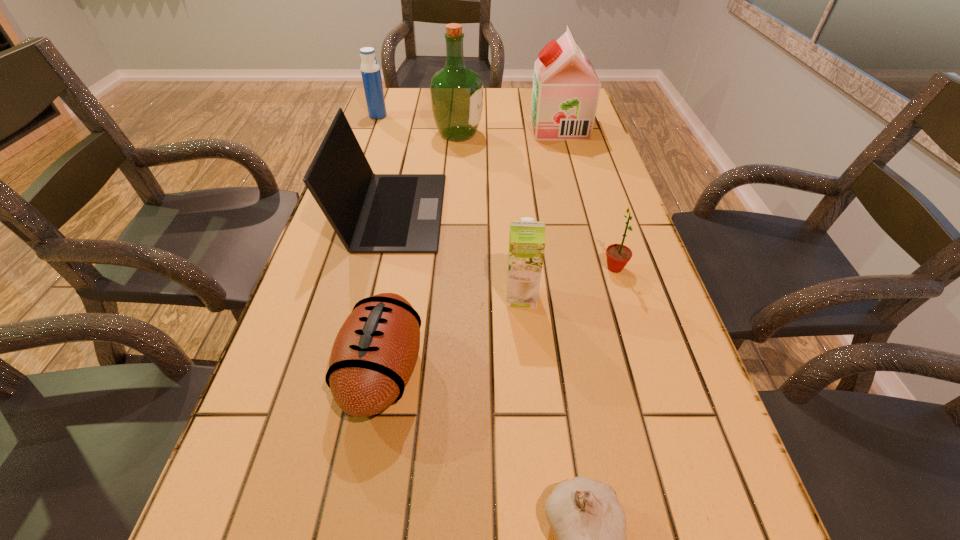
At what (x,y) coordinates should I click in order to perform the action: click on vacant space located on the front-facing side of the liquor. Please return your answer as a coordinate pair (x, y). This screenshot has width=960, height=540. Looking at the image, I should click on (528, 134).

This screenshot has width=960, height=540. Find the location of `free spot located with the cap open on the farther soya milk`. free spot located with the cap open on the farther soya milk is located at coordinates (420, 127).

What are the coordinates of `free space located with the cap open on the farther soya milk` in the screenshot? It's located at (468, 127).

Image resolution: width=960 pixels, height=540 pixels. Find the location of `free region located 0.370m with the cap open on the farther soya milk`. free region located 0.370m with the cap open on the farther soya milk is located at coordinates (423, 127).

This screenshot has width=960, height=540. I want to click on free location located on the back of the water bottle, so click(x=386, y=94).

Locate an element on the screen. The width and height of the screenshot is (960, 540). free space located 0.090m on the screen of the fifth nearest object is located at coordinates (476, 211).

I want to click on vacant space located on the left of the left soya milk, so click(362, 296).

I want to click on vacant space located 0.080m on the face of the fifth farthest object, so click(x=567, y=268).

Find the location of a particular element. vacant space located 0.260m on the face of the fifth farthest object is located at coordinates (489, 268).

Locate an element on the screen. The height and width of the screenshot is (540, 960). free space located on the face of the fifth farthest object is located at coordinates (519, 268).